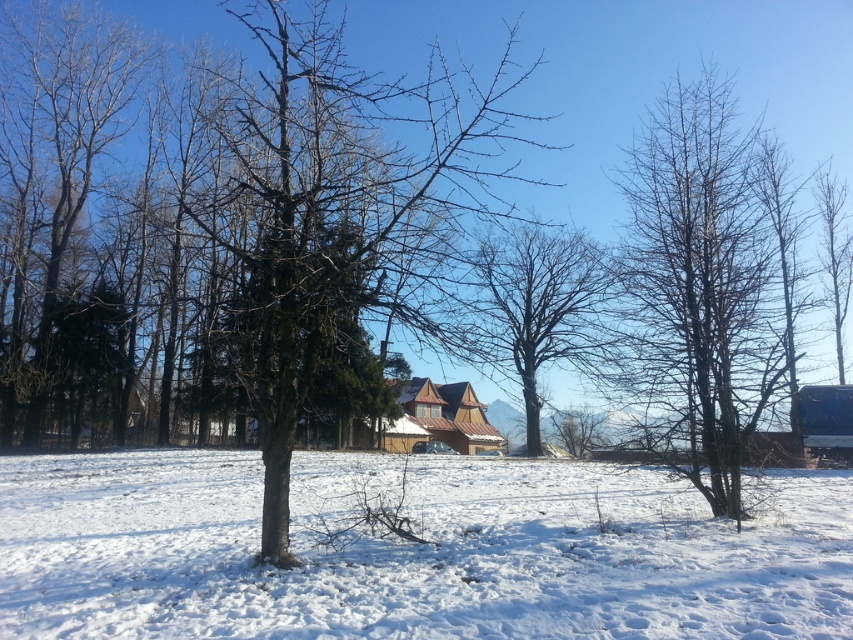
You are standing in the winter landscape and want to take a photo of the bare wood tree at left and the white fluffy snow at center. Where should you position yourself to capture both in the frame?

Position yourself so that the bare wood tree at left is above the white fluffy snow at center, as the white fluffy snow at center is located below the bare wood tree at left according to the description.

You are planning to build a snowman using the white fluffy snow at center and want to use the bare wood tree at left as a reference. Based on their widths, which one is wider?

The white fluffy snow at center is wider than the bare wood tree at left.

You are standing in the winter landscape and want to walk from the brown rough bark tree at center to the white fluffy snow at center. Which direction should you face to walk directly towards your destination?

You should face to the right because the white fluffy snow at center is positioned on the right side of the brown rough bark tree at center.